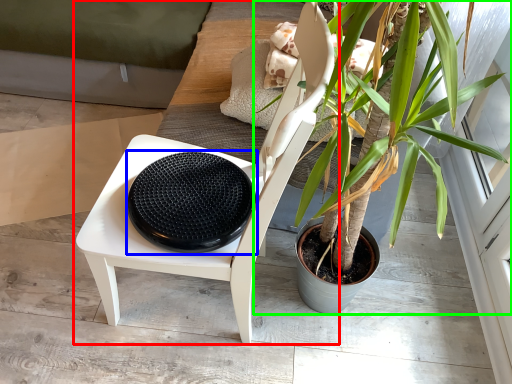
Question: Which object is the closest to the chair (highlighted by a red box)? Choose among these: footrest (highlighted by a blue box) or houseplant (highlighted by a green box).

Choices:
 (A) footrest
 (B) houseplant

Answer: (A)